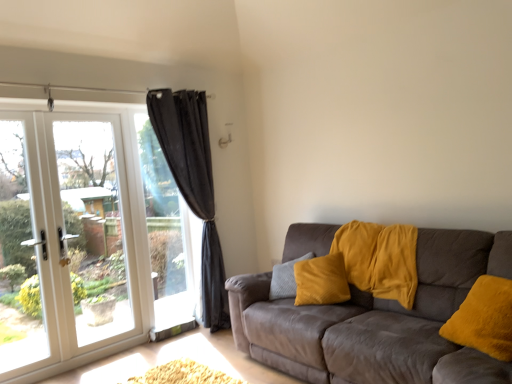
This screenshot has width=512, height=384. In order to click on free point below black sheer curtain at left (from a real-world perspective) in this screenshot , I will do `click(197, 338)`.